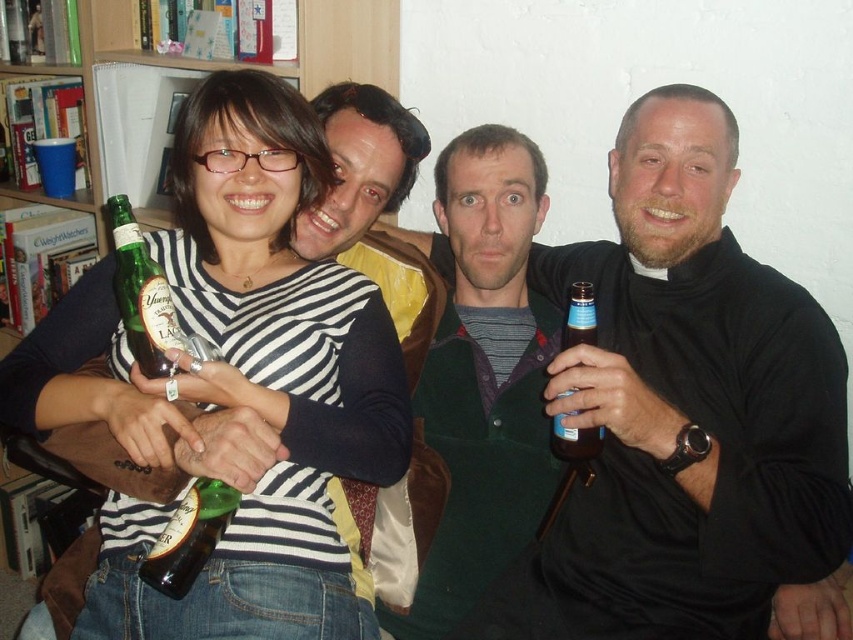
Question: Does green wool sweater at center appear on the right side of green glass bottle at left?

Choices:
 (A) no
 (B) yes

Answer: (B)

Question: Which point appears closest to the camera in this image?

Choices:
 (A) (590, 429)
 (B) (781, 560)
 (C) (483, 131)

Answer: (B)

Question: Does smooth brown leather jacket at center have a smaller size compared to translucent glass bottle at center?

Choices:
 (A) no
 (B) yes

Answer: (A)

Question: Which object appears farthest from the camera in this image?

Choices:
 (A) green glass bottle at left
 (B) green glass bottle at center
 (C) translucent glass bottle at center
 (D) smooth brown leather jacket at center

Answer: (C)

Question: Which point appears closest to the camera in this image?

Choices:
 (A) (590, 440)
 (B) (419, 132)

Answer: (A)

Question: Is green wool sweater at center closer to the viewer compared to matte black shirt at center?

Choices:
 (A) no
 (B) yes

Answer: (B)